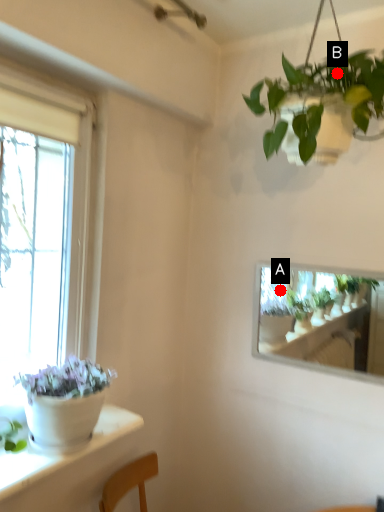
Question: Two points are circled on the image, labeled by A and B beside each circle. Among these points, which one is farthest from the camera?

Choices:
 (A) A is further
 (B) B is further

Answer: (A)